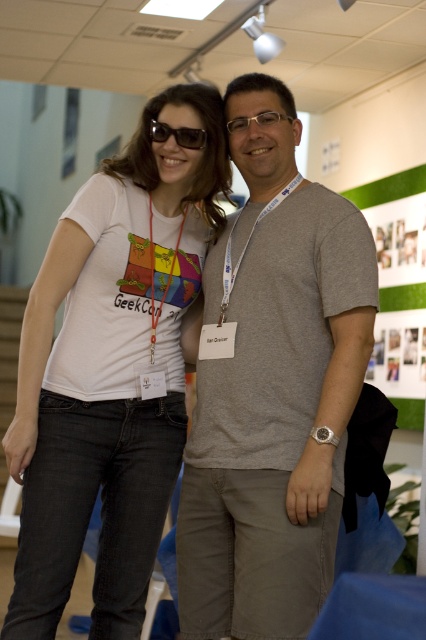
Question: Does white cotton t-shirt at center appear over black plastic sunglasses at upper center?

Choices:
 (A) yes
 (B) no

Answer: (B)

Question: Is white cotton t-shirt at center bigger than black plastic sunglasses at upper center?

Choices:
 (A) no
 (B) yes

Answer: (B)

Question: Does gray cotton t-shirt at center appear on the left side of black plastic sunglasses at upper center?

Choices:
 (A) yes
 (B) no

Answer: (B)

Question: Which of these objects is positioned closest to the gray cotton t-shirt at center?

Choices:
 (A) white cotton t-shirt at center
 (B) black plastic sunglasses at upper center

Answer: (A)

Question: Which of the following is the farthest from the observer?

Choices:
 (A) black plastic sunglasses at upper center
 (B) white cotton t-shirt at center
 (C) gray cotton t-shirt at center

Answer: (A)

Question: Which of the following is the closest to the observer?

Choices:
 (A) black plastic sunglasses at upper center
 (B) white cotton t-shirt at center

Answer: (B)